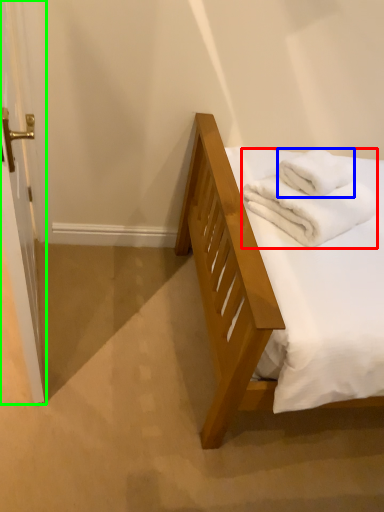
Question: Which object is the closest to the bath towel (highlighted by a red box)? Choose among these: bath towel (highlighted by a blue box) or screen door (highlighted by a green box).

Choices:
 (A) bath towel
 (B) screen door

Answer: (A)